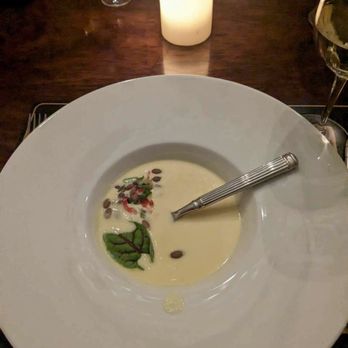
At what (x,y) coordinates should I click in order to perform the action: click on spoon. Please return your answer as a coordinate pair (x, y). The width and height of the screenshot is (348, 348). Looking at the image, I should click on (209, 194).